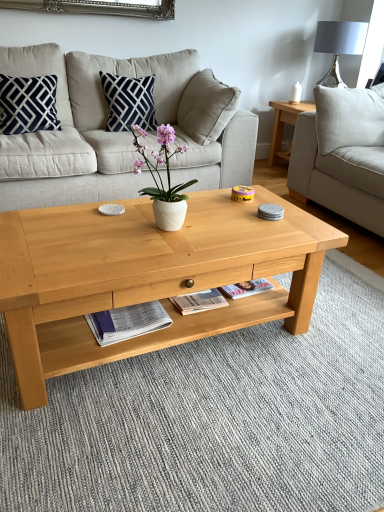
Image resolution: width=384 pixels, height=512 pixels. I want to click on free location to the right of white matte vase at center, so click(x=212, y=233).